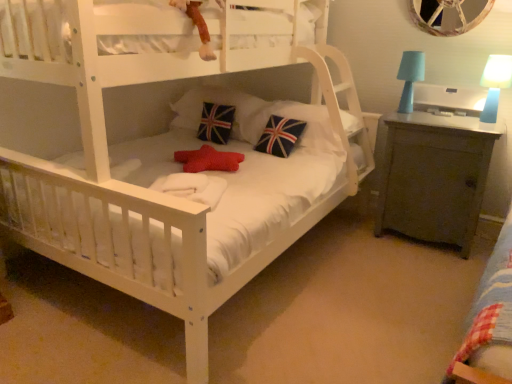
What do you see at coordinates (495, 84) in the screenshot? The width and height of the screenshot is (512, 384). I see `blue plastic table lamp at upper right, which ranks as the second table lamp in left-to-right order` at bounding box center [495, 84].

Describe the element at coordinates (410, 77) in the screenshot. The width and height of the screenshot is (512, 384). I see `matte blue lampshade at upper right, which is the 1th table lamp in left-to-right order` at that location.

Describe the element at coordinates (216, 123) in the screenshot. I see `union jack fabric pillow at center, acting as the 3th pillow starting from the right` at that location.

Describe the element at coordinates (218, 104) in the screenshot. The image size is (512, 384). I see `union jack fabric pillow at center, the 2th pillow when ordered from left to right` at that location.

In order to click on matte gray cabinet at right in this screenshot , I will do `click(433, 177)`.

Locate an element on the screen. Image resolution: width=512 pixels, height=384 pixels. blue plastic table lamp at upper right, which ranks as the second table lamp in left-to-right order is located at coordinates (495, 84).

Based on the photo, from the image's perspective, does matte blue lampshade at upper right, which is the 1th table lamp in left-to-right order, appear lower than velvety plush monkey at upper center?

Indeed, from the image's perspective, matte blue lampshade at upper right, which is the 1th table lamp in left-to-right order, is shown beneath velvety plush monkey at upper center.

Can you confirm if matte blue lampshade at upper right, positioned as the second table lamp in right-to-left order, is taller than velvety plush monkey at upper center?

Correct, matte blue lampshade at upper right, positioned as the second table lamp in right-to-left order, is much taller as velvety plush monkey at upper center.

Can you see matte blue lampshade at upper right, positioned as the second table lamp in right-to-left order, touching velvety plush monkey at upper center?

No, matte blue lampshade at upper right, positioned as the second table lamp in right-to-left order, is not beside velvety plush monkey at upper center.

Considering the relative sizes of velvety plush monkey at upper center and blue plastic table lamp at upper right, which ranks as the second table lamp in left-to-right order, in the image provided, is velvety plush monkey at upper center shorter than blue plastic table lamp at upper right, which ranks as the second table lamp in left-to-right order,?

Yes, velvety plush monkey at upper center is shorter than blue plastic table lamp at upper right, which ranks as the second table lamp in left-to-right order.

Is velvety plush monkey at upper center in contact with blue plastic table lamp at upper right, which ranks as the second table lamp in left-to-right order?

No, velvety plush monkey at upper center is not beside blue plastic table lamp at upper right, which ranks as the second table lamp in left-to-right order.

Is velvety plush monkey at upper center positioned before blue plastic table lamp at upper right, which ranks as the second table lamp in left-to-right order?

Yes, velvety plush monkey at upper center is closer to the camera.

Looking at this image, considering the relative sizes of blue plastic table lamp at upper right, placed as the first table lamp when sorted from right to left, and matte blue lampshade at upper right, which is the 1th table lamp in left-to-right order, in the image provided, is blue plastic table lamp at upper right, placed as the first table lamp when sorted from right to left, shorter than matte blue lampshade at upper right, which is the 1th table lamp in left-to-right order,?

Indeed, blue plastic table lamp at upper right, placed as the first table lamp when sorted from right to left, has a lesser height compared to matte blue lampshade at upper right, which is the 1th table lamp in left-to-right order.

Could you tell me if blue plastic table lamp at upper right, placed as the first table lamp when sorted from right to left, is turned towards matte blue lampshade at upper right, positioned as the second table lamp in right-to-left order?

No, blue plastic table lamp at upper right, placed as the first table lamp when sorted from right to left, is not turned towards matte blue lampshade at upper right, positioned as the second table lamp in right-to-left order.

This screenshot has width=512, height=384. I want to click on table lamp above the blue plastic table lamp at upper right, placed as the first table lamp when sorted from right to left (from the image's perspective), so click(x=410, y=77).

From a real-world perspective, is blue plastic table lamp at upper right, which ranks as the second table lamp in left-to-right order, positioned over matte blue lampshade at upper right, positioned as the second table lamp in right-to-left order, based on gravity?

No, from a real-world perspective, blue plastic table lamp at upper right, which ranks as the second table lamp in left-to-right order, is not on top of matte blue lampshade at upper right, positioned as the second table lamp in right-to-left order.

In the scene shown: Could you measure the distance between union jack fabric pillow at center, which ranks as the third pillow in left-to-right order, and matte blue lampshade at upper right, which is the 1th table lamp in left-to-right order?

The distance of union jack fabric pillow at center, which ranks as the third pillow in left-to-right order, from matte blue lampshade at upper right, which is the 1th table lamp in left-to-right order, is 23.52 inches.

Are union jack fabric pillow at center, which ranks as the third pillow in left-to-right order, and matte blue lampshade at upper right, which is the 1th table lamp in left-to-right order, far apart?

They are positioned close to each other.

I want to click on pillow located in front of the matte blue lampshade at upper right, positioned as the second table lamp in right-to-left order, so click(300, 120).

Is union jack fabric pillow at center, which ranks as the 1th pillow in right-to-left order, closer to camera compared to matte blue lampshade at upper right, positioned as the second table lamp in right-to-left order?

Yes, the depth of union jack fabric pillow at center, which ranks as the 1th pillow in right-to-left order, is less than that of matte blue lampshade at upper right, positioned as the second table lamp in right-to-left order.

Considering the positions of points (487, 65) and (247, 130), is point (487, 65) closer to camera compared to point (247, 130)?

Yes, point (487, 65) is closer to viewer.

Is blue plastic table lamp at upper right, placed as the first table lamp when sorted from right to left, facing towards union jack fabric pillow at center, which ranks as the 1th pillow in right-to-left order?

No, blue plastic table lamp at upper right, placed as the first table lamp when sorted from right to left, is not oriented towards union jack fabric pillow at center, which ranks as the 1th pillow in right-to-left order.

From the image's perspective, does blue plastic table lamp at upper right, which ranks as the second table lamp in left-to-right order, appear higher than union jack fabric pillow at center, which ranks as the third pillow in left-to-right order?

Indeed, from the image's perspective, blue plastic table lamp at upper right, which ranks as the second table lamp in left-to-right order, is shown above union jack fabric pillow at center, which ranks as the third pillow in left-to-right order.

This screenshot has height=384, width=512. I want to click on the 1st table lamp above the union jack fabric pillow at center, which ranks as the 1th pillow in right-to-left order (from the image's perspective), so click(495, 84).

From a real-world perspective, which object stands above the other?

In real-world perspective, blue plastic table lamp at upper right, placed as the first table lamp when sorted from right to left, is above.

Between union jack fabric pillow at center, which ranks as the third pillow in left-to-right order, and blue plastic table lamp at upper right, which ranks as the second table lamp in left-to-right order, which one has smaller size?

blue plastic table lamp at upper right, which ranks as the second table lamp in left-to-right order, is smaller.

Does union jack fabric pillow at center, which ranks as the third pillow in left-to-right order, have a lesser height compared to blue plastic table lamp at upper right, placed as the first table lamp when sorted from right to left?

Yes.

Does union jack fabric pillow at center, which ranks as the third pillow in left-to-right order, turn towards blue plastic table lamp at upper right, placed as the first table lamp when sorted from right to left?

No, union jack fabric pillow at center, which ranks as the third pillow in left-to-right order, does not turn towards blue plastic table lamp at upper right, placed as the first table lamp when sorted from right to left.

What's the angular difference between union jack fabric pillow at center, the 2th pillow when ordered from left to right, and blue plastic table lamp at upper right, placed as the first table lamp when sorted from right to left,'s facing directions?

There is a 0.859-degree angle between the facing directions of union jack fabric pillow at center, the 2th pillow when ordered from left to right, and blue plastic table lamp at upper right, placed as the first table lamp when sorted from right to left.

Does union jack fabric pillow at center, acting as the second pillow starting from the right, have a larger size compared to blue plastic table lamp at upper right, which ranks as the second table lamp in left-to-right order?

Correct, union jack fabric pillow at center, acting as the second pillow starting from the right, is larger in size than blue plastic table lamp at upper right, which ranks as the second table lamp in left-to-right order.

From the picture: From a real-world perspective, between union jack fabric pillow at center, acting as the second pillow starting from the right, and blue plastic table lamp at upper right, placed as the first table lamp when sorted from right to left, who is vertically higher?

blue plastic table lamp at upper right, placed as the first table lamp when sorted from right to left, is physically above.

Considering the relative sizes of union jack fabric pillow at center, the 2th pillow when ordered from left to right, and blue plastic table lamp at upper right, placed as the first table lamp when sorted from right to left, in the image provided, is union jack fabric pillow at center, the 2th pillow when ordered from left to right, wider than blue plastic table lamp at upper right, placed as the first table lamp when sorted from right to left,?

Yes, union jack fabric pillow at center, the 2th pillow when ordered from left to right, is wider than blue plastic table lamp at upper right, placed as the first table lamp when sorted from right to left.

At what (x,y) coordinates should I click in order to perform the action: click on toy above the matte blue lampshade at upper right, which is the 1th table lamp in left-to-right order (from a real-world perspective). Please return your answer as a coordinate pair (x, y). Looking at the image, I should click on (197, 25).

You are a GUI agent. You are given a task and a screenshot of the screen. Output one action in this format:
    pyautogui.click(x=<x>, y=<y>)
    Task: Click on the toy located on the left of blue plastic table lamp at upper right, which ranks as the second table lamp in left-to-right order
    This screenshot has width=512, height=384.
    Given the screenshot: What is the action you would take?
    pyautogui.click(x=197, y=25)

Considering their positions, is union jack fabric pillow at center, which ranks as the 1th pillow in left-to-right order, positioned closer to velvety plush monkey at upper center than matte blue lampshade at upper right, positioned as the second table lamp in right-to-left order?

Based on the image, union jack fabric pillow at center, which ranks as the 1th pillow in left-to-right order, appears to be nearer to velvety plush monkey at upper center.

Considering their positions, is matte gray cabinet at right positioned further to matte blue lampshade at upper right, positioned as the second table lamp in right-to-left order, than union jack fabric pillow at center, which ranks as the third pillow in left-to-right order?

union jack fabric pillow at center, which ranks as the third pillow in left-to-right order, is further to matte blue lampshade at upper right, positioned as the second table lamp in right-to-left order.

Based on their spatial positions, is blue plastic table lamp at upper right, which ranks as the second table lamp in left-to-right order, or union jack fabric pillow at center, which ranks as the 1th pillow in right-to-left order, closer to velvety plush monkey at upper center?

union jack fabric pillow at center, which ranks as the 1th pillow in right-to-left order, is closer to velvety plush monkey at upper center.

From the image, which object appears to be nearer to blue plastic table lamp at upper right, which ranks as the second table lamp in left-to-right order, union jack fabric pillow at center, which ranks as the third pillow in left-to-right order, or union jack fabric pillow at center, acting as the second pillow starting from the right?

The object closer to blue plastic table lamp at upper right, which ranks as the second table lamp in left-to-right order, is union jack fabric pillow at center, which ranks as the third pillow in left-to-right order.

Considering their positions, is union jack fabric pillow at center, which ranks as the third pillow in left-to-right order, positioned closer to blue plastic table lamp at upper right, placed as the first table lamp when sorted from right to left, than matte blue lampshade at upper right, which is the 1th table lamp in left-to-right order?

matte blue lampshade at upper right, which is the 1th table lamp in left-to-right order, lies closer to blue plastic table lamp at upper right, placed as the first table lamp when sorted from right to left, than the other object.

Which object lies nearer to the anchor point blue plastic table lamp at upper right, which ranks as the second table lamp in left-to-right order, velvety plush monkey at upper center or union jack fabric pillow at center, acting as the 3th pillow starting from the right?

velvety plush monkey at upper center is positioned closer to the anchor blue plastic table lamp at upper right, which ranks as the second table lamp in left-to-right order.

Which object lies further to the anchor point union jack fabric pillow at center, the 2th pillow when ordered from left to right, velvety plush monkey at upper center or matte gray cabinet at right?

matte gray cabinet at right is positioned further to the anchor union jack fabric pillow at center, the 2th pillow when ordered from left to right.

Considering their positions, is union jack fabric pillow at center, the 2th pillow when ordered from left to right, positioned further to velvety plush monkey at upper center than union jack fabric pillow at center, which ranks as the third pillow in left-to-right order?

union jack fabric pillow at center, the 2th pillow when ordered from left to right.

This screenshot has height=384, width=512. Identify the location of pillow between velvety plush monkey at upper center and blue plastic table lamp at upper right, placed as the first table lamp when sorted from right to left. (300, 120).

Locate an element on the screen. This screenshot has height=384, width=512. pillow between velvety plush monkey at upper center and matte gray cabinet at right in the horizontal direction is located at coordinates (300, 120).

Locate an element on the screen. The height and width of the screenshot is (384, 512). toy situated between union jack fabric pillow at center, the 2th pillow when ordered from left to right, and matte blue lampshade at upper right, positioned as the second table lamp in right-to-left order, from left to right is located at coordinates tap(197, 25).

At what (x,y) coordinates should I click in order to perform the action: click on table lamp situated between velvety plush monkey at upper center and matte gray cabinet at right from left to right. Please return your answer as a coordinate pair (x, y). The image size is (512, 384). Looking at the image, I should click on (410, 77).